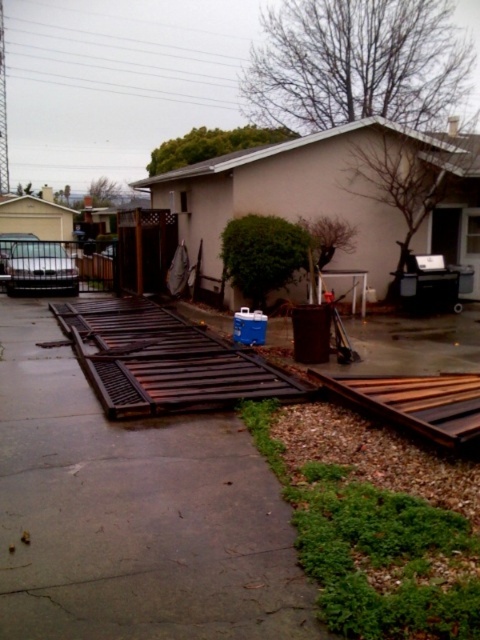
You are a delivery person trying to deliver a package to the house. The package requires a flat surface to place it. You see the brown wooden planks at center and the brown metal train track at center. Which surface would be more suitable for placing the package?

The brown wooden planks at center are taller than the brown metal train track at center, so the brown metal train track at center is flatter and more suitable for placing the package.

Based on the photo, you are a delivery person trying to navigate a narrow path between the brown wooden planks at center and the brown metal train track at center. Your delivery cart is 30 inches wide. Can you safely pass through the gap between them?

The distance between the brown wooden planks at center and the brown metal train track at center is 32.66 inches. Since your cart is 30 inches wide, there is enough space to safely pass through the gap.

You are a delivery person trying to deliver a package to the house. The package is too heavy to carry and needs to be rolled on the ground. The path to the house is through the driveway. There are brown wooden planks at center and brown metal train track at center in the way. Which object should you avoid rolling the package over to prevent damage?

You should avoid rolling the package over the brown wooden planks at center because they might be wider than the brown metal train track at center, which could cause the package to get stuck or damaged on the wider surface.